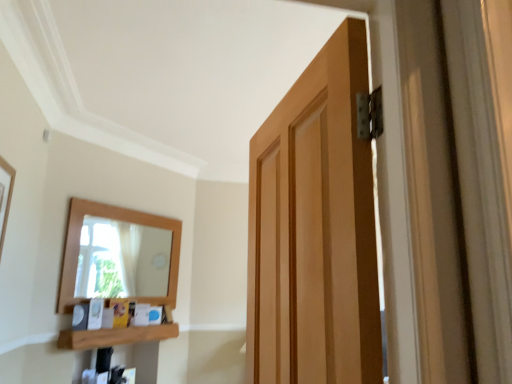
Question: Is wooden picture frame at left positioned before wooden at lower left?

Choices:
 (A) yes
 (B) no

Answer: (A)

Question: Could wooden at lower left be considered to be inside wooden picture frame at left?

Choices:
 (A) yes
 (B) no

Answer: (B)

Question: Is wooden picture frame at left bigger than wooden at lower left?

Choices:
 (A) no
 (B) yes

Answer: (A)

Question: From a real-world perspective, is wooden picture frame at left beneath wooden at lower left?

Choices:
 (A) no
 (B) yes

Answer: (A)

Question: Considering the relative positions of wooden picture frame at left and wooden at lower left in the image provided, is wooden picture frame at left to the left of wooden at lower left from the viewer's perspective?

Choices:
 (A) yes
 (B) no

Answer: (A)

Question: Is wooden picture frame at left with wooden at lower left?

Choices:
 (A) yes
 (B) no

Answer: (B)

Question: Can you confirm if wooden at lower left is wider than wooden picture frame at left?

Choices:
 (A) no
 (B) yes

Answer: (B)

Question: From a real-world perspective, is wooden at lower left below wooden picture frame at left?

Choices:
 (A) no
 (B) yes

Answer: (B)

Question: Can you confirm if wooden at lower left is positioned to the left of wooden picture frame at left?

Choices:
 (A) yes
 (B) no

Answer: (B)

Question: Can you confirm if wooden at lower left is shorter than wooden picture frame at left?

Choices:
 (A) yes
 (B) no

Answer: (A)

Question: From a real-world perspective, is wooden at lower left located higher than wooden picture frame at left?

Choices:
 (A) yes
 (B) no

Answer: (B)

Question: Is wooden at lower left next to wooden picture frame at left?

Choices:
 (A) no
 (B) yes

Answer: (A)

Question: Does point (0, 163) appear closer or farther from the camera than point (69, 336)?

Choices:
 (A) closer
 (B) farther

Answer: (A)